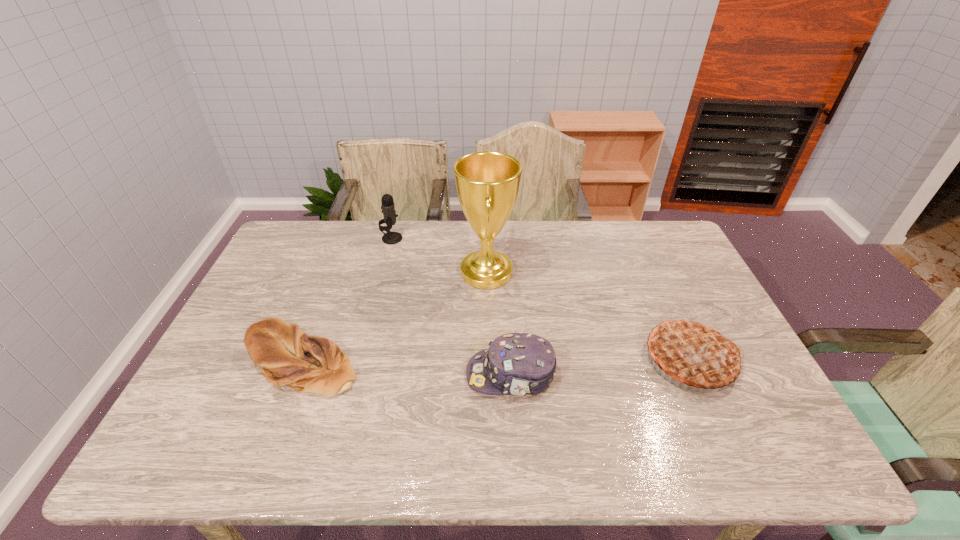
This screenshot has width=960, height=540. Find the location of `free space at the left edge`. free space at the left edge is located at coordinates point(259,397).

This screenshot has width=960, height=540. In the image, there is a desktop. In order to click on vacant space at the right edge in this screenshot , I will do `click(687, 291)`.

Image resolution: width=960 pixels, height=540 pixels. In the image, there is a desktop. Identify the location of free space at the near left corner. click(x=170, y=458).

Identify the location of vacant space in between the headwear and the shortest object. The height and width of the screenshot is (540, 960). (406, 368).

The image size is (960, 540). Find the location of `free area in between the award and the headwear`. free area in between the award and the headwear is located at coordinates (499, 323).

The image size is (960, 540). Find the location of `empty location between the bread and the tallest object`. empty location between the bread and the tallest object is located at coordinates (394, 316).

Identify the location of vacant space in between the shortest object and the headwear. (406, 368).

You are a GUI agent. You are given a task and a screenshot of the screen. Output one action in this format:
    pyautogui.click(x=<x>, y=<y>)
    Task: Click on the empty location between the rightmost object and the tallest object
    The image size is (960, 540).
    Given the screenshot: What is the action you would take?
    pyautogui.click(x=588, y=316)

This screenshot has width=960, height=540. In order to click on free spot between the microphone and the fourth tallest object in this screenshot , I will do `click(451, 307)`.

Find the location of a particular element. This screenshot has height=540, width=960. free space between the award and the microphone is located at coordinates (439, 255).